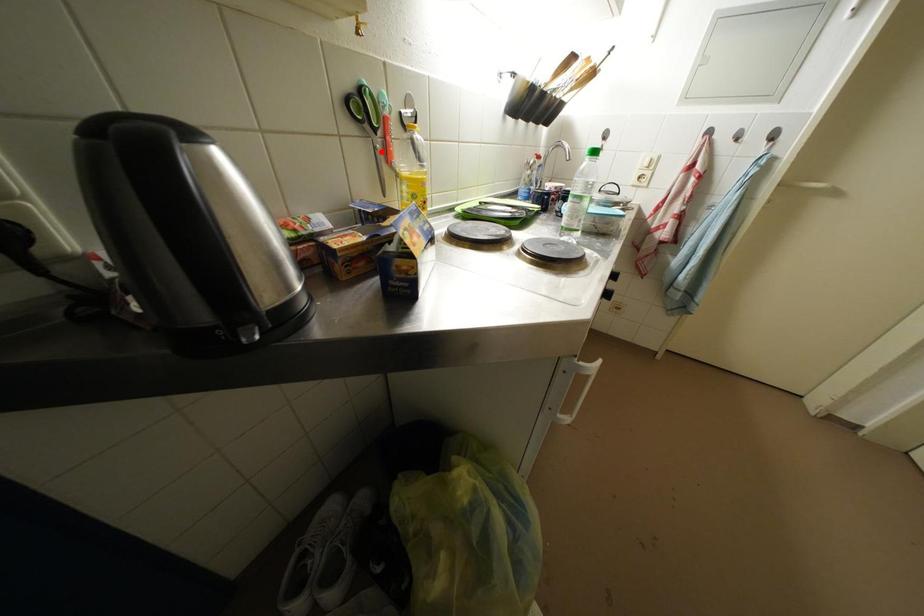
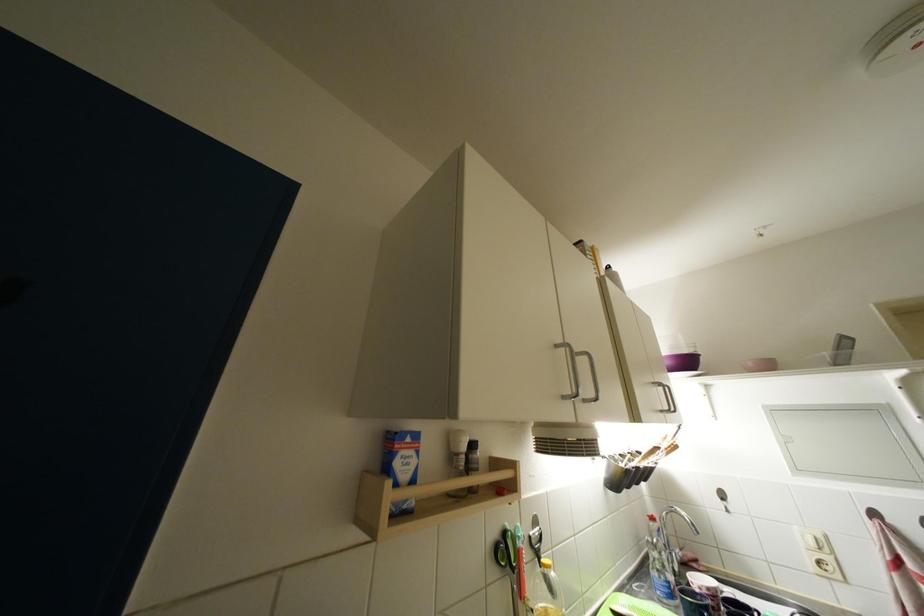
Find the pixel in the second image that matches the highlighted location in the first image.

(518, 594)